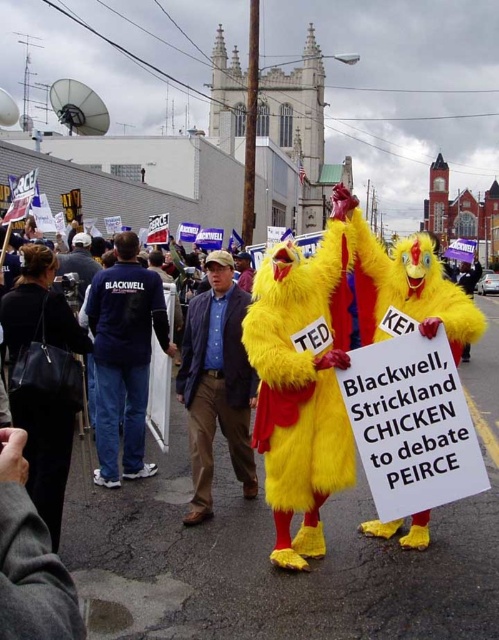
What do you see at coordinates (217, 384) in the screenshot?
I see `blue denim shirt at center` at bounding box center [217, 384].

Who is taller, blue denim shirt at center or blue cotton shirt at center?

blue cotton shirt at center is taller.

Which is in front, point (203, 465) or point (94, 349)?

Point (203, 465) is more forward.

Locate an element on the screen. The image size is (499, 640). blue denim shirt at center is located at coordinates (217, 384).